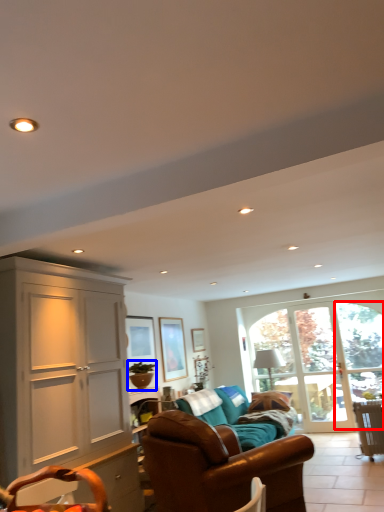
Question: Which object appears farthest to the camera in this image, window (highlighted by a red box) or houseplant (highlighted by a blue box)?

Choices:
 (A) window
 (B) houseplant

Answer: (A)